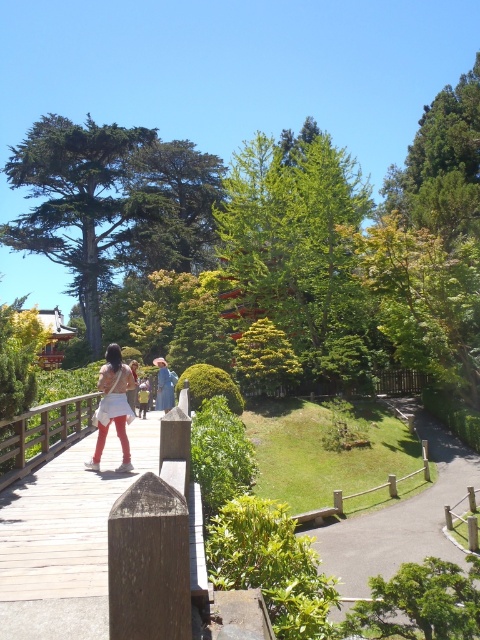
Does wooden bridge at center have a smaller size compared to smooth asphalt path at center?

Yes, wooden bridge at center is smaller than smooth asphalt path at center.

Is point (132, 554) positioned behind point (436, 486)?

No.

The width and height of the screenshot is (480, 640). I want to click on wooden bridge at center, so click(x=111, y=548).

At what (x,y) coordinates should I click in order to perform the action: click on wooden bridge at center. Please return your answer as a coordinate pair (x, y). Looking at the image, I should click on (111, 548).

Does smooth asphalt path at center appear on the right side of matte white skirt at center?

Correct, you'll find smooth asphalt path at center to the right of matte white skirt at center.

Does smooth asphalt path at center appear on the left side of matte white skirt at center?

Incorrect, smooth asphalt path at center is not on the left side of matte white skirt at center.

Does point (352, 566) lie behind point (121, 408)?

Yes, it is behind point (121, 408).

What are the coordinates of `smooth asphalt path at center` in the screenshot? It's located at (400, 516).

Does wooden bridge at center appear on the right side of matte blue dress at center?

Indeed, wooden bridge at center is positioned on the right side of matte blue dress at center.

Which is more to the left, wooden bridge at center or matte blue dress at center?

matte blue dress at center is more to the left.

Does point (29, 497) come closer to viewer compared to point (170, 401)?

Yes, it is.

Identify the location of wooden bridge at center. coord(111,548).